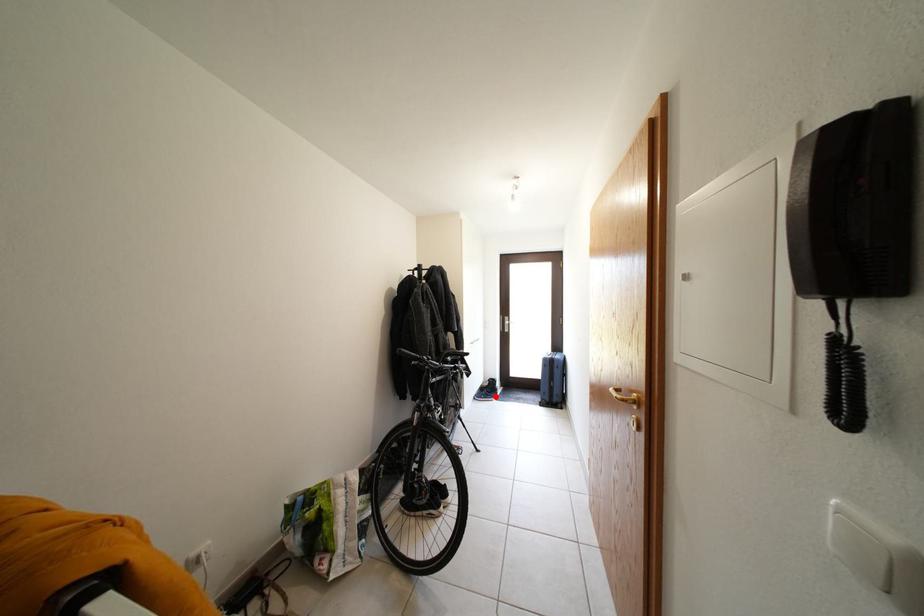
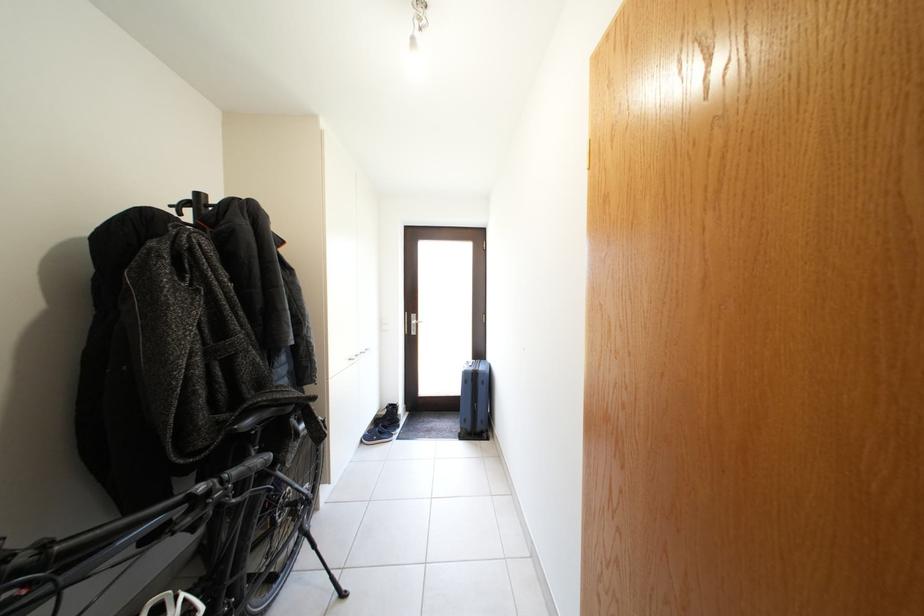
Locate, in the second image, the point that corresponds to the highlighted location in the first image.

(392, 431)